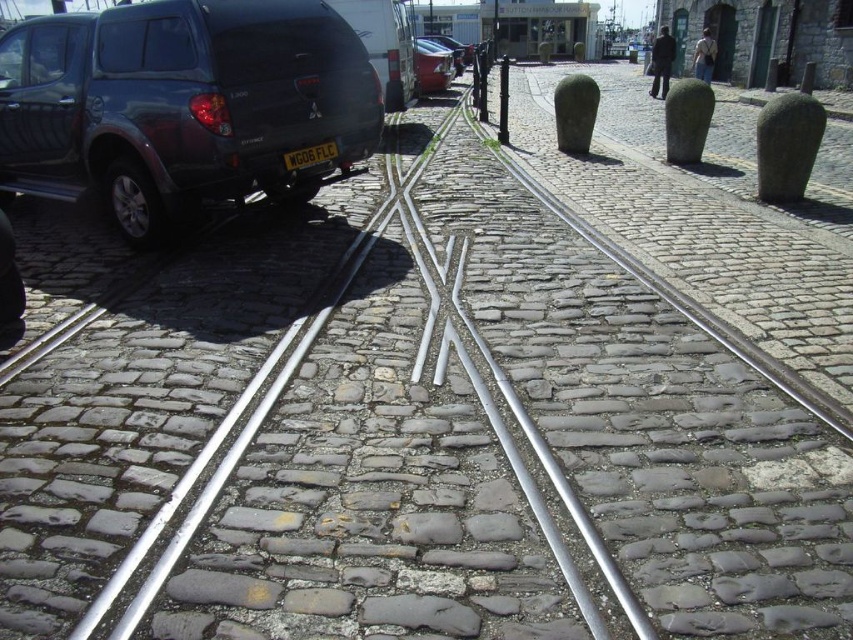
You are a delivery person needing to park your vehicle in a space that can only accommodate cars up to the width of the shiny red car at center. Can the matte black suv at left fit in this space?

The matte black suv at left is wider than the shiny red car at center, so it cannot fit in the space designated for the shiny red car at center.

In the scene shown: You are a pedestrian standing on the cobblestone street and want to walk from the tram tracks to the parked vehicles. Which direction should you go to first reach the matte black suv at left before the black plastic license plate at center?

You should head towards the left side of the street because the matte black suv at left is positioned to the left of the black plastic license plate at center, so you will reach it first by moving in that direction.